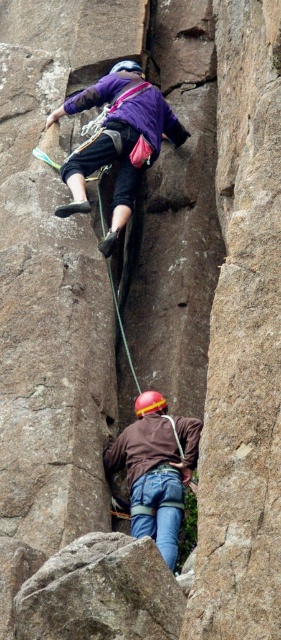
Between rough textured rock at lower center and matte purple shirt at upper center, which one has less height?

With less height is rough textured rock at lower center.

Between rough textured rock at lower center and matte purple shirt at upper center, which one is positioned lower?

rough textured rock at lower center is lower down.

Which is behind, point (161, 616) or point (136, 140)?

The point (136, 140) is more distant.

Identify the location of rough textured rock at lower center. (100, 593).

Who is lower down, rough textured rock at lower center or brown matte jacket at center?

Positioned lower is rough textured rock at lower center.

Which of these two, rough textured rock at lower center or brown matte jacket at center, stands shorter?

Standing shorter between the two is rough textured rock at lower center.

I want to click on rough textured rock at lower center, so click(x=100, y=593).

Does matte purple shirt at upper center appear on the left side of brown matte jacket at center?

Indeed, matte purple shirt at upper center is positioned on the left side of brown matte jacket at center.

Is point (134, 92) less distant than point (128, 470)?

That is False.

You are a GUI agent. You are given a task and a screenshot of the screen. Output one action in this format:
    pyautogui.click(x=<x>, y=<y>)
    Task: Click on the matte purple shirt at upper center
    Image resolution: width=281 pixels, height=640 pixels.
    Given the screenshot: What is the action you would take?
    pyautogui.click(x=118, y=140)